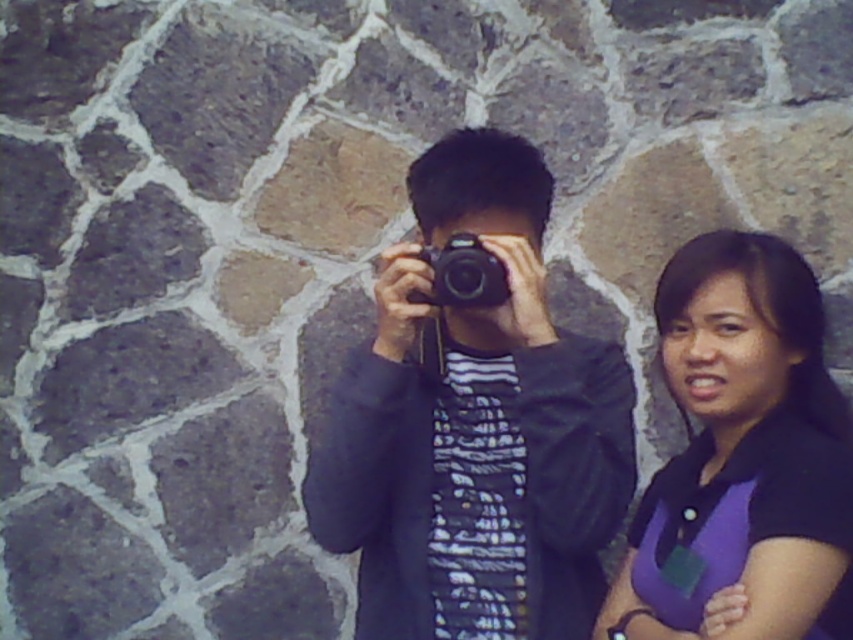
Consider the image. Who is higher up, matte black camera at center or purple matte shirt at right?

Positioned higher is matte black camera at center.

Can you confirm if matte black camera at center is positioned to the right of purple matte shirt at right?

Incorrect, matte black camera at center is not on the right side of purple matte shirt at right.

Find the location of a particular element. The image size is (853, 640). matte black camera at center is located at coordinates (474, 428).

Who is more distant from viewer, (567, 451) or (486, 276)?

Point (567, 451)

Does matte black camera at center have a greater width compared to black plastic camera at center?

Yes, matte black camera at center is wider than black plastic camera at center.

Identify the location of matte black camera at center. This screenshot has height=640, width=853. (474, 428).

Does purple matte shirt at right have a lesser width compared to black plastic camera at center?

No, purple matte shirt at right is not thinner than black plastic camera at center.

Can you confirm if purple matte shirt at right is bigger than black plastic camera at center?

Correct, purple matte shirt at right is larger in size than black plastic camera at center.

In the scene shown: Who is more distant from viewer, (x=747, y=540) or (x=462, y=257)?

Positioned behind is point (x=462, y=257).

Locate an element on the screen. The image size is (853, 640). purple matte shirt at right is located at coordinates (747, 445).